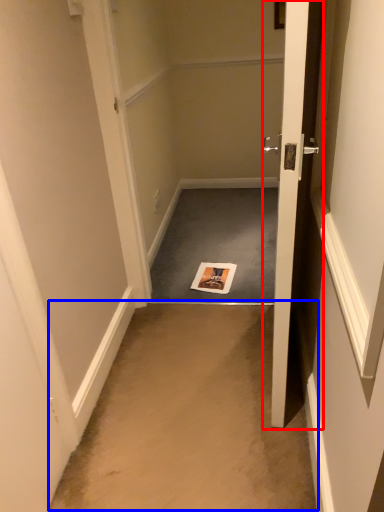
Question: Which point is further to the camera, door (highlighted by a red box) or corridor (highlighted by a blue box)?

Choices:
 (A) door
 (B) corridor

Answer: (B)